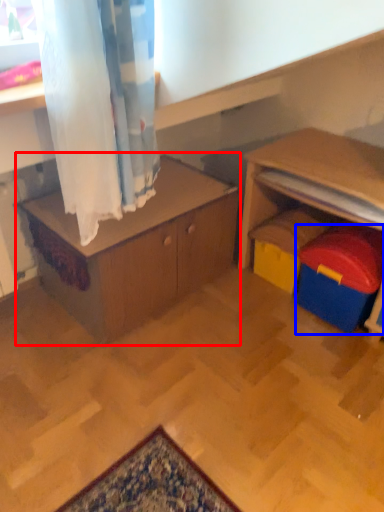
Question: Which of the following is the closest to the observer, table (highlighted by a red box) or toy (highlighted by a blue box)?

Choices:
 (A) table
 (B) toy

Answer: (A)